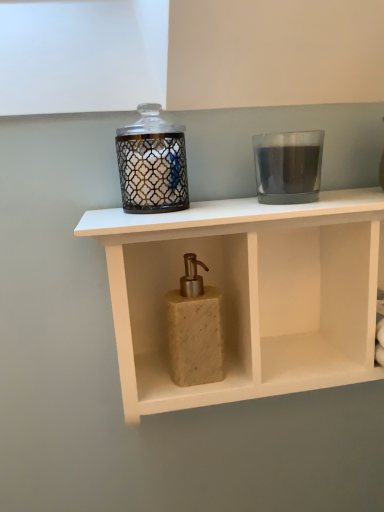
Question: From a real-world perspective, is beige stone soap dispenser at center beneath transparent glass candle at upper right, the second candle holder positioned from the left?

Choices:
 (A) no
 (B) yes

Answer: (B)

Question: Is beige stone soap dispenser at center to the right of transparent glass candle at upper right, placed as the 1th candle holder when sorted from right to left, from the viewer's perspective?

Choices:
 (A) no
 (B) yes

Answer: (A)

Question: Is beige stone soap dispenser at center shorter than transparent glass candle at upper right, placed as the 1th candle holder when sorted from right to left?

Choices:
 (A) no
 (B) yes

Answer: (A)

Question: From a real-world perspective, does beige stone soap dispenser at center stand above transparent glass candle at upper right, placed as the 1th candle holder when sorted from right to left?

Choices:
 (A) no
 (B) yes

Answer: (A)

Question: Is beige stone soap dispenser at center oriented away from transparent glass candle at upper right, placed as the 1th candle holder when sorted from right to left?

Choices:
 (A) no
 (B) yes

Answer: (A)

Question: In terms of height, does matte glass candle holder at upper center, which is counted as the 2th candle holder, starting from the right, look taller or shorter compared to beige stone soap dispenser at center?

Choices:
 (A) tall
 (B) short

Answer: (B)

Question: Looking at the image, does matte glass candle holder at upper center, which is counted as the 2th candle holder, starting from the right, seem bigger or smaller compared to beige stone soap dispenser at center?

Choices:
 (A) small
 (B) big

Answer: (A)

Question: Would you say matte glass candle holder at upper center, which is the first candle holder in left-to-right order, is to the left or to the right of beige stone soap dispenser at center in the picture?

Choices:
 (A) right
 (B) left

Answer: (B)

Question: From the image's perspective, is matte glass candle holder at upper center, which is the first candle holder in left-to-right order, above or below beige stone soap dispenser at center?

Choices:
 (A) above
 (B) below

Answer: (A)

Question: From their relative heights in the image, would you say matte glass candle holder at upper center, which is the first candle holder in left-to-right order, is taller or shorter than transparent glass candle at upper right, the second candle holder positioned from the left?

Choices:
 (A) short
 (B) tall

Answer: (A)

Question: Is matte glass candle holder at upper center, which is counted as the 2th candle holder, starting from the right, bigger or smaller than transparent glass candle at upper right, the second candle holder positioned from the left?

Choices:
 (A) big
 (B) small

Answer: (B)

Question: Visually, is matte glass candle holder at upper center, which is the first candle holder in left-to-right order, positioned to the left or to the right of transparent glass candle at upper right, placed as the 1th candle holder when sorted from right to left?

Choices:
 (A) right
 (B) left

Answer: (B)

Question: Is matte glass candle holder at upper center, which is the first candle holder in left-to-right order, spatially inside transparent glass candle at upper right, placed as the 1th candle holder when sorted from right to left, or outside of it?

Choices:
 (A) inside
 (B) outside

Answer: (B)

Question: Based on their sizes in the image, would you say beige stone soap dispenser at center is bigger or smaller than transparent glass candle at upper right, the second candle holder positioned from the left?

Choices:
 (A) small
 (B) big

Answer: (B)

Question: Is beige stone soap dispenser at center inside the boundaries of transparent glass candle at upper right, the second candle holder positioned from the left, or outside?

Choices:
 (A) inside
 (B) outside

Answer: (B)